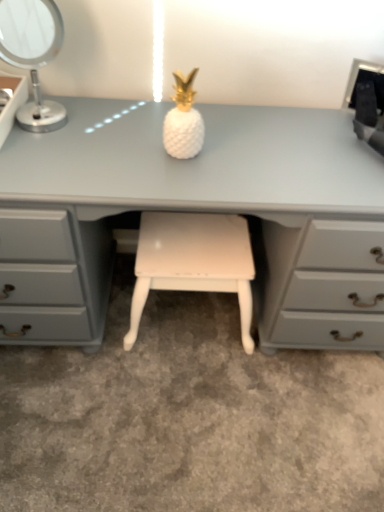
This screenshot has width=384, height=512. I want to click on vacant area that is situated to the right of silver metallic table lamp at upper left, so click(107, 128).